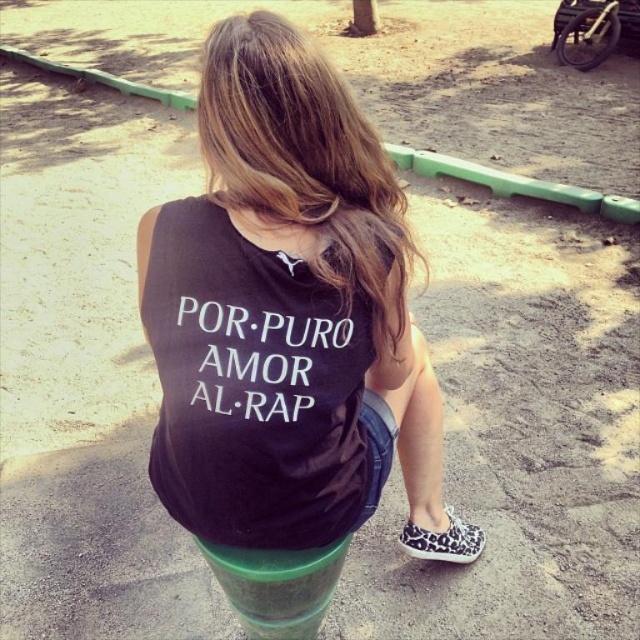
This screenshot has height=640, width=640. Find the location of `black matte tank top at center`. black matte tank top at center is located at coordinates (289, 316).

Is black matte tank top at center closer to camera compared to black cotton tank top at center?

Yes, it is.

Measure the distance between black matte tank top at center and camera.

They are 3.65 feet apart.

Find the location of a particular element. This screenshot has width=640, height=640. black matte tank top at center is located at coordinates (289, 316).